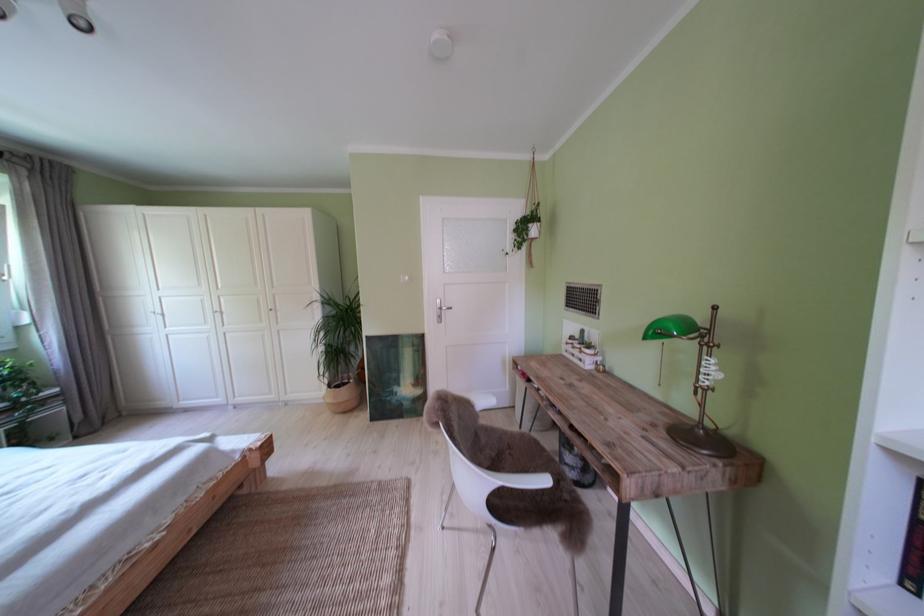
Find the location of `white cabinet handle`. white cabinet handle is located at coordinates (156, 312).